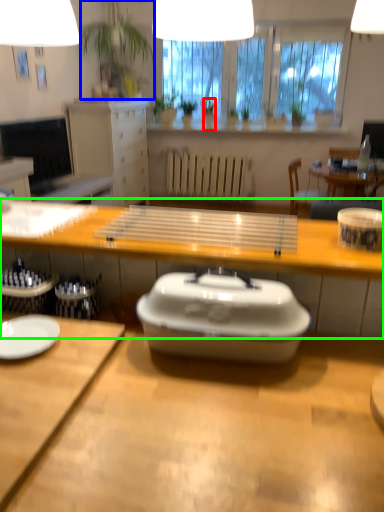
Question: Considering the real-world distances, which object is closest to houseplant (highlighted by a red box)? houseplant (highlighted by a blue box) or desk (highlighted by a green box).

Choices:
 (A) houseplant
 (B) desk

Answer: (A)